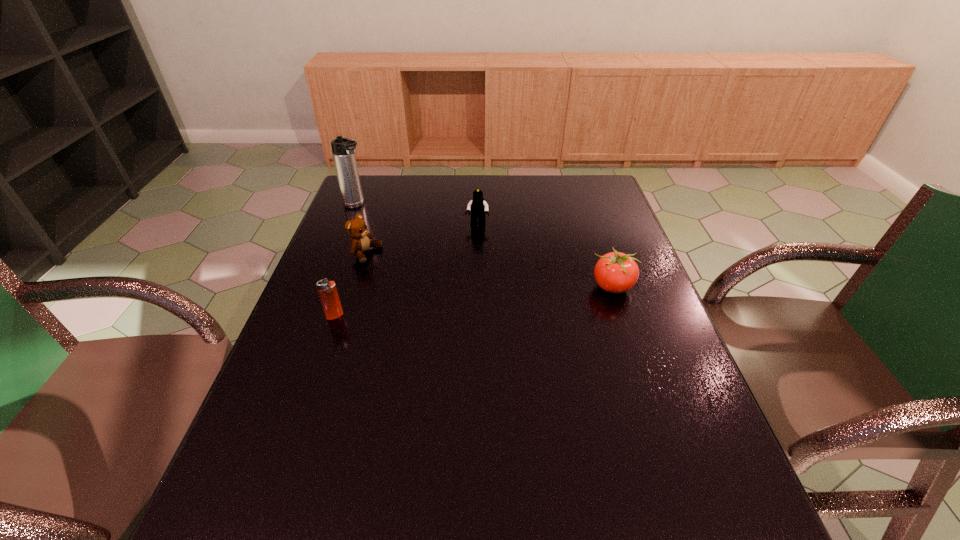
Locate an element on the screen. free spot on the desktop that is between the igniter and the second nearest object and is positioned on the front-facing side of the third nearest object is located at coordinates (503, 298).

The height and width of the screenshot is (540, 960). I want to click on vacant space on the desktop that is between the nearest object and the tomato and is positioned on the front-facing side of the Lego, so click(461, 302).

Find the location of `vacant space on the desktop that is between the nearest object and the second nearest object and is positioned on the handle side of the thermos bottle`. vacant space on the desktop that is between the nearest object and the second nearest object and is positioned on the handle side of the thermos bottle is located at coordinates (513, 297).